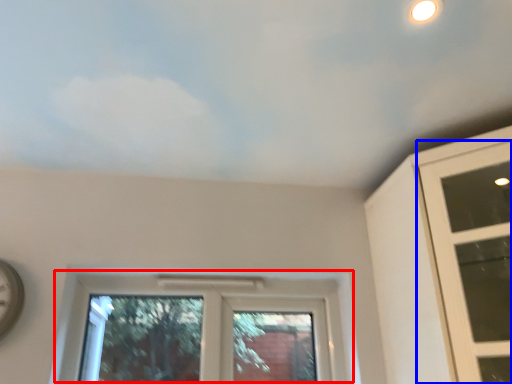
Question: Which point is further to the camera, window (highlighted by a red box) or window (highlighted by a blue box)?

Choices:
 (A) window
 (B) window

Answer: (A)